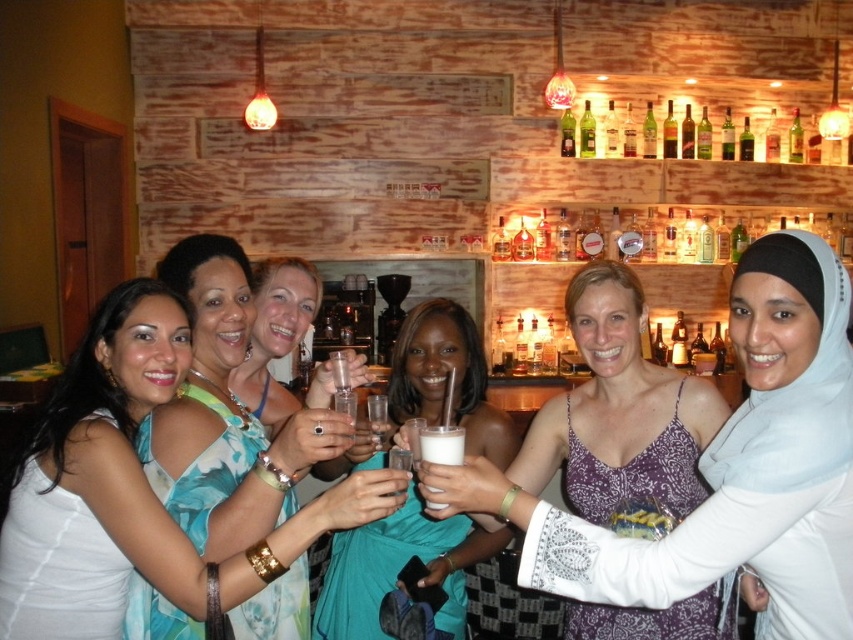
You are a photographer trying to capture the women in the center of the image. There is a point at coordinates point [132,492] that you need to focus on. Which woman is this point located on?

The point [132,492] is on the white fabric dress at center, so it is located on the woman wearing the white fabric dress at center.

You are a bartender who needs to pour the white frothy liquid at center into the translucent glass bottle at center. Can you fit the entire liquid into the bottle without spilling?

The white frothy liquid at center has a smaller width than the translucent glass bottle at center, so it can fit inside without spilling.

You are a photographer at the event and want to ensure both the white fabric dress at center and the teal floral dress at center are clearly visible in your photo. Which dress should you focus on first to ensure it doesn

The white fabric dress at center is larger in size than the teal floral dress at center, so focusing on the white fabric dress at center first will ensure it is clearly visible, and then adjust for the smaller teal floral dress at center.